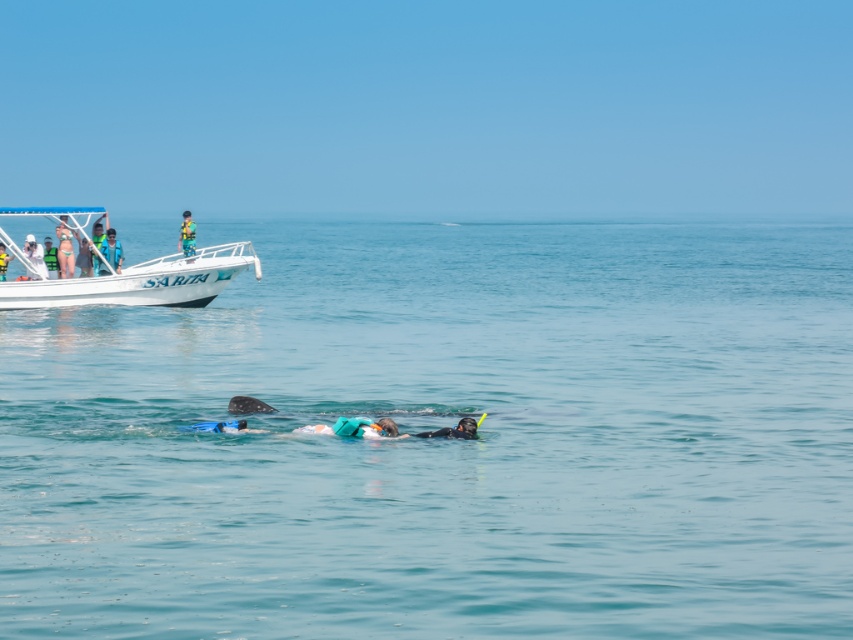
Who is taller, matte bikini at left or green life vest at center?

With more height is green life vest at center.

Which is more to the left, matte bikini at left or green life vest at center?

Positioned to the left is green life vest at center.

Between point (68, 268) and point (189, 237), which one is positioned in front?

Positioned in front is point (68, 268).

Find the location of a particular element. matte bikini at left is located at coordinates (65, 252).

Does white plastic boat at upper left have a larger size compared to matte green bikini at upper left?

Yes, white plastic boat at upper left is bigger than matte green bikini at upper left.

Does white plastic boat at upper left have a lesser width compared to matte green bikini at upper left?

In fact, white plastic boat at upper left might be wider than matte green bikini at upper left.

Does point (142, 285) lie in front of point (78, 252)?

Yes, it is.

Locate an element on the screen. white plastic boat at upper left is located at coordinates (141, 282).

You are a GUI agent. You are given a task and a screenshot of the screen. Output one action in this format:
    pyautogui.click(x=<x>, y=<y>)
    Task: Click on the blue-green fabric shirt at left
    
    Given the screenshot: What is the action you would take?
    pyautogui.click(x=111, y=250)

What do you see at coordinates (111, 250) in the screenshot? The width and height of the screenshot is (853, 640). I see `blue-green fabric shirt at left` at bounding box center [111, 250].

Is point (119, 266) positioned before point (7, 260)?

That is False.

Locate an element on the screen. blue-green fabric shirt at left is located at coordinates (111, 250).